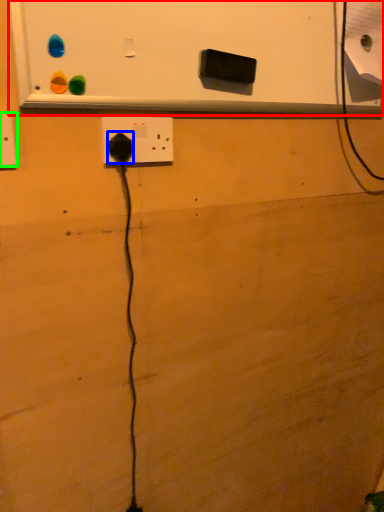
Question: Considering the real-world distances, which object is closest to bulletin board (highlighted by a red box)? power plugs and sockets (highlighted by a blue box) or power plugs and sockets (highlighted by a green box).

Choices:
 (A) power plugs and sockets
 (B) power plugs and sockets

Answer: (A)